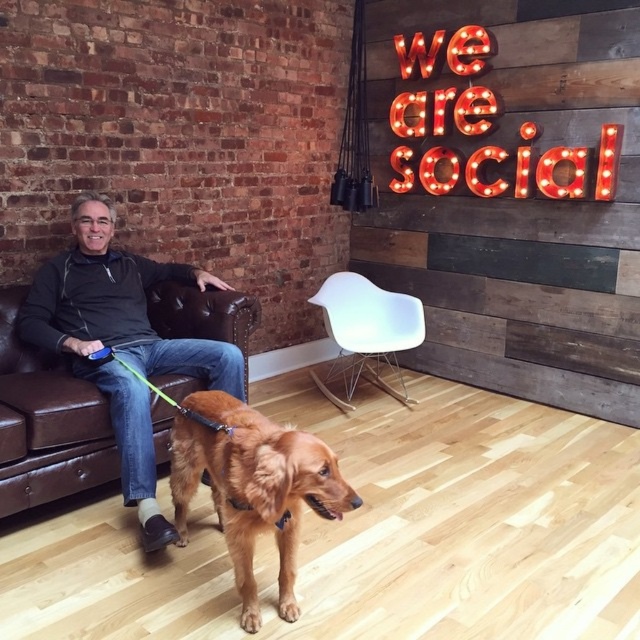
Question: Does golden fur dog at lower center appear on the right side of white plastic chair at center?

Choices:
 (A) yes
 (B) no

Answer: (B)

Question: Is golden fur dog at lower center further to camera compared to red illuminated letters at upper right?

Choices:
 (A) no
 (B) yes

Answer: (A)

Question: Estimate the real-world distances between objects in this image. Which object is closer to the matte black leather couch at left?

Choices:
 (A) red illuminated letters at upper right
 (B) white plastic chair at center
 (C) golden fur dog at lower center

Answer: (C)

Question: Which point is closer to the camera?

Choices:
 (A) white plastic chair at center
 (B) matte black leather couch at left
 (C) golden fur dog at lower center
 (D) red illuminated letters at upper right

Answer: (C)

Question: Is matte black leather couch at left bigger than red illuminated letters at upper right?

Choices:
 (A) yes
 (B) no

Answer: (A)

Question: Based on their relative distances, which object is nearer to the red illuminated letters at upper right?

Choices:
 (A) matte black leather couch at left
 (B) golden fur dog at lower center
 (C) white plastic chair at center

Answer: (C)